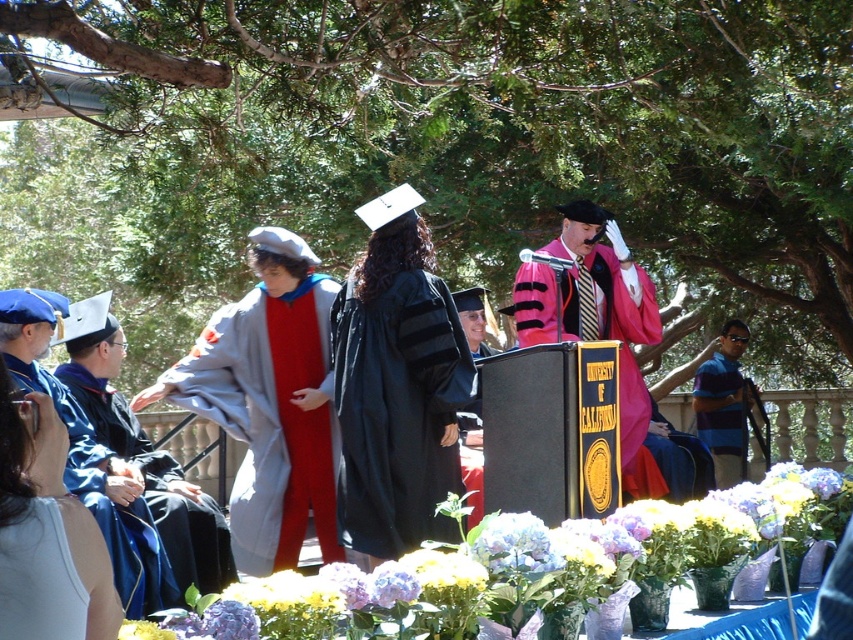
Consider the image. Can you confirm if black matte graduation gown at center is positioned below matte pink fabric graduation gown at center?

Yes, black matte graduation gown at center is below matte pink fabric graduation gown at center.

Between point (444, 467) and point (587, 298), which one is positioned in front?

Positioned in front is point (444, 467).

What are the coordinates of `black matte graduation gown at center` in the screenshot? It's located at (397, 412).

Can you confirm if black matte graduation gown at center is thinner than white matte robe at lower left?

Incorrect, black matte graduation gown at center's width is not less than white matte robe at lower left's.

Measure the distance between black matte graduation gown at center and white matte robe at lower left.

The distance of black matte graduation gown at center from white matte robe at lower left is 4.00 meters.

Image resolution: width=853 pixels, height=640 pixels. Describe the element at coordinates (397, 412) in the screenshot. I see `black matte graduation gown at center` at that location.

Locate an element on the screen. This screenshot has width=853, height=640. black matte graduation gown at center is located at coordinates (397, 412).

Who is more distant from viewer, (x=178, y=544) or (x=704, y=424)?

Positioned behind is point (x=704, y=424).

How far apart are blue velvet gown at left and striped polo shirt at right?

A distance of 6.95 meters exists between blue velvet gown at left and striped polo shirt at right.

The height and width of the screenshot is (640, 853). I want to click on blue velvet gown at left, so click(x=144, y=451).